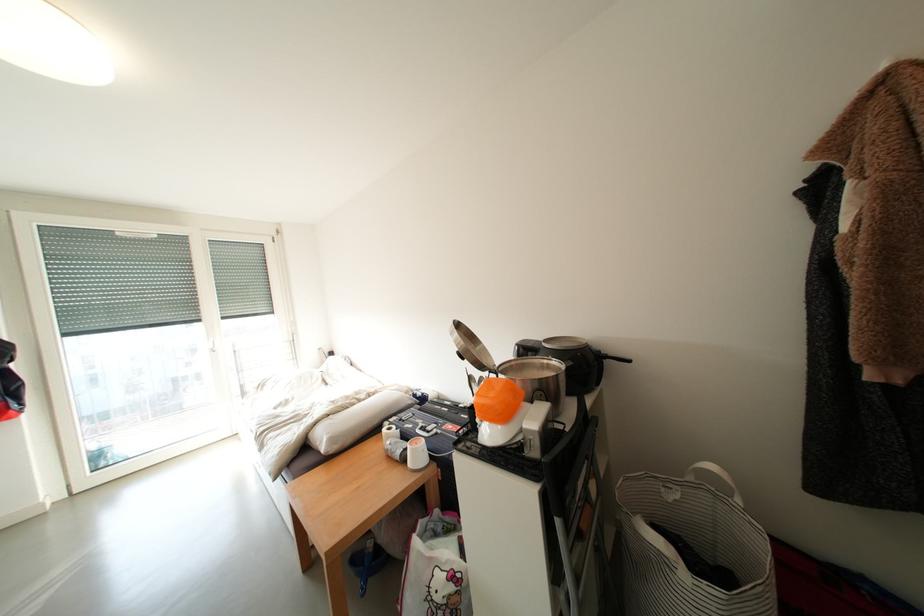
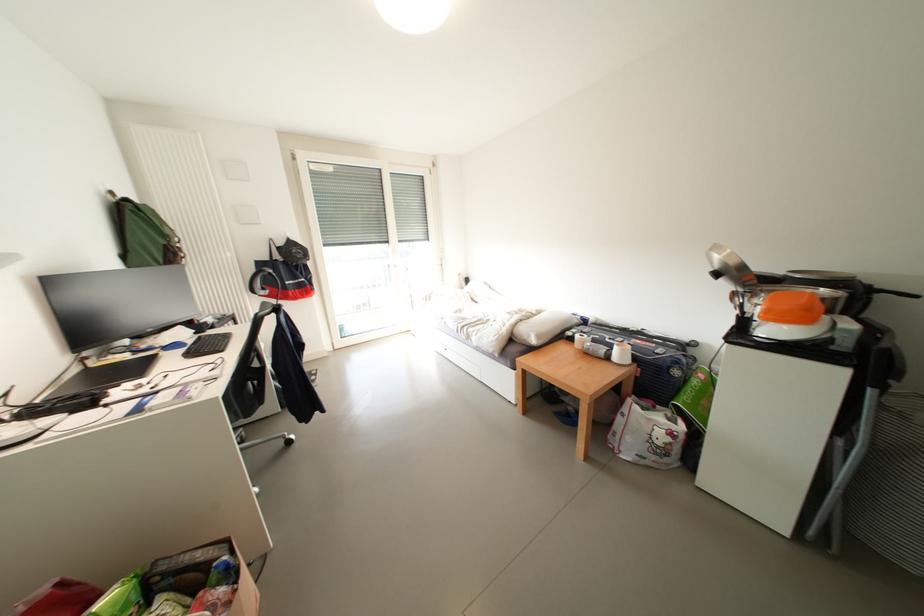
In the second image, find the point that corresponds to the point at 467,525 in the first image.

(662, 410)